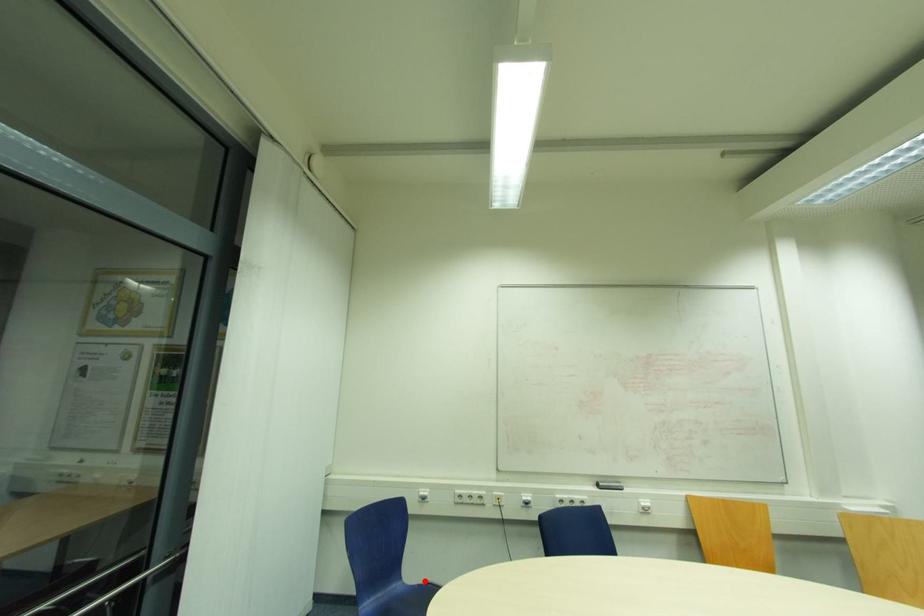
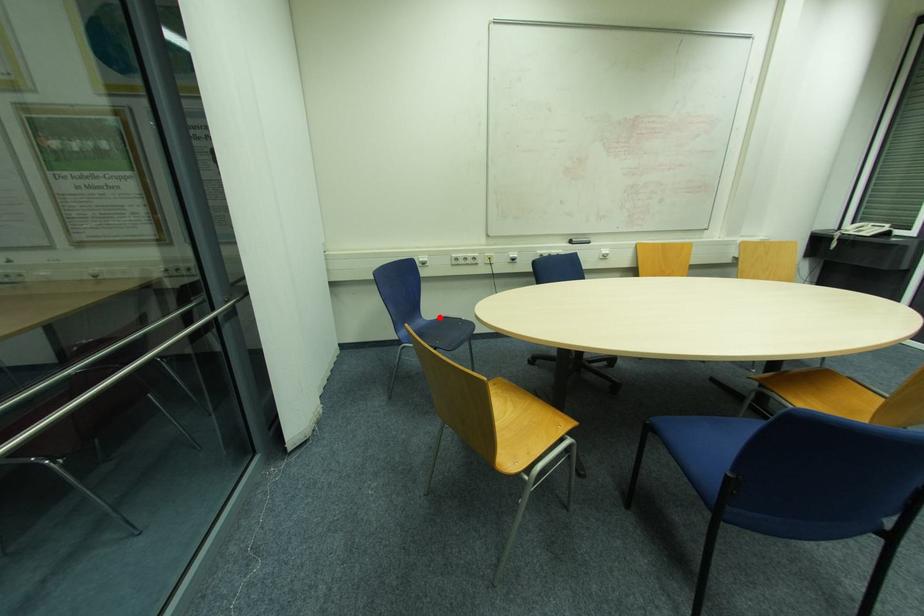
I am providing you with two images of the same scene from different viewpoints. A red point is marked on the first image and another point is marked on the second image. Are the points marked in image1 and image2 representing the same 3D position?

Yes